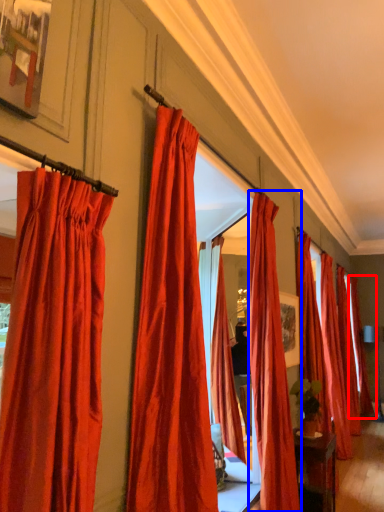
Question: Which object appears closest to the camera in this image, curtain (highlighted by a red box) or curtain (highlighted by a blue box)?

Choices:
 (A) curtain
 (B) curtain

Answer: (B)